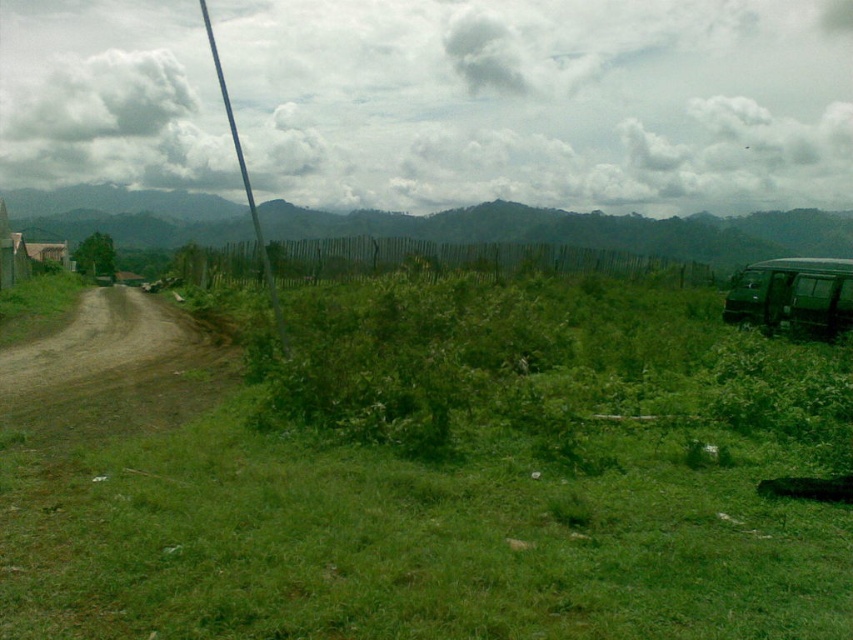
You are standing at the point with coordinates point [846,316] and want to walk to the point with coordinates point [142,385]. Based on the scene, will you have to walk over any obstacles or through any areas that might be difficult to traverse?

The point [142,385] is in front of point [846,316]. Since the path between them is across a grassy terrain with scattered debris, you might encounter some obstacles like debris, but the scene does not mention any significant barriers like fences or water bodies. Proceed with caution.

You are a hiker trying to decide whether to take the brown dirt track at left or the green matte van at right for a shortcut. Considering their sizes, which path or vehicle would you choose if you need more space for your backpack?

The green matte van at right is larger than the brown dirt track at left, so choosing the green matte van at right would provide more space for your backpack.

You are a hiker trying to cross the area shown in the image. You need to decide whether to walk on the green grass at center or the brown dirt track at left. Which surface is shorter in height and thus easier to traverse?

The green grass at center has a lesser height compared to brown dirt track at left, so it is shorter and easier to traverse.